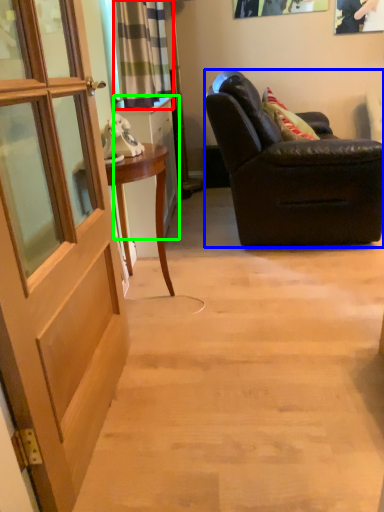
Question: Based on their relative distances, which object is farther from curtain (highlighted by a red box)? Choose from chair (highlighted by a blue box) and cabinetry (highlighted by a green box).

Choices:
 (A) chair
 (B) cabinetry

Answer: (A)